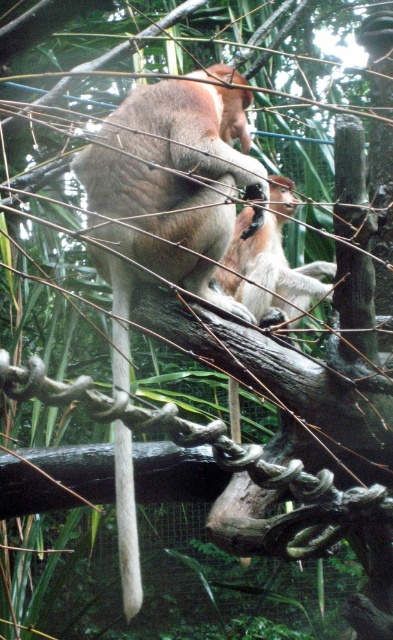
Which of these two, brown furry proboscis monkey at center or white matte tail at center, stands shorter?

white matte tail at center

Is brown furry proboscis monkey at center below white matte tail at center?

No.

Between point (157, 96) and point (119, 548), which one is positioned behind?

The point (157, 96) is more distant.

Find the location of `brown furry proboscis monkey at center`. brown furry proboscis monkey at center is located at coordinates (174, 180).

Which is more to the left, brown furry proboscis monkey at center or light brown fur monkey at center?

From the viewer's perspective, brown furry proboscis monkey at center appears more on the left side.

This screenshot has width=393, height=640. Identify the location of brown furry proboscis monkey at center. (174, 180).

The image size is (393, 640). Find the location of `brown furry proboscis monkey at center`. brown furry proboscis monkey at center is located at coordinates (174, 180).

Is light brown fur monkey at center positioned in front of white matte tail at center?

No, light brown fur monkey at center is further to the viewer.

Between light brown fur monkey at center and white matte tail at center, which one is positioned lower?

Positioned lower is white matte tail at center.

This screenshot has height=640, width=393. Identify the location of light brown fur monkey at center. (271, 262).

Locate an element on the screen. The height and width of the screenshot is (640, 393). light brown fur monkey at center is located at coordinates (271, 262).